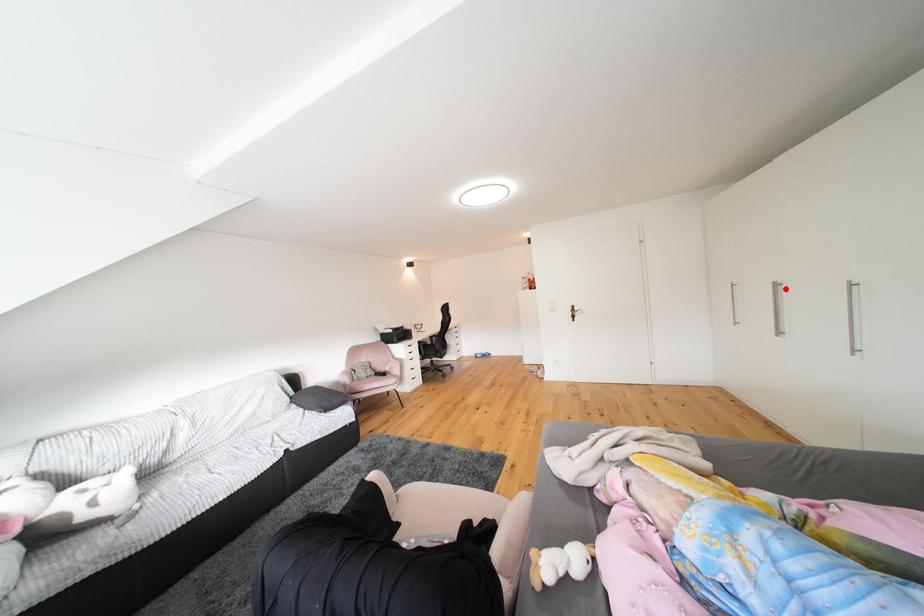
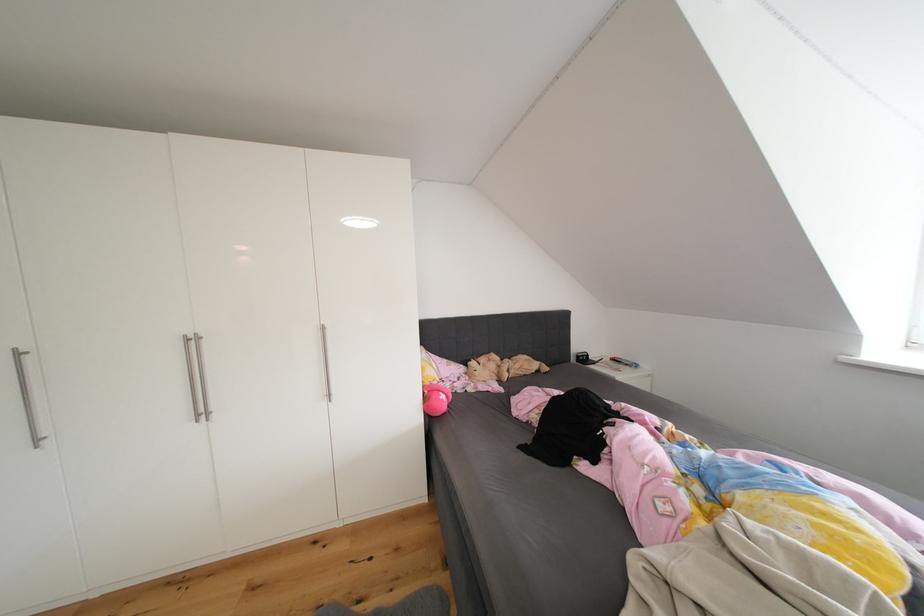
Locate, in the second image, the point that corresponds to the highlighted location in the first image.

(201, 344)